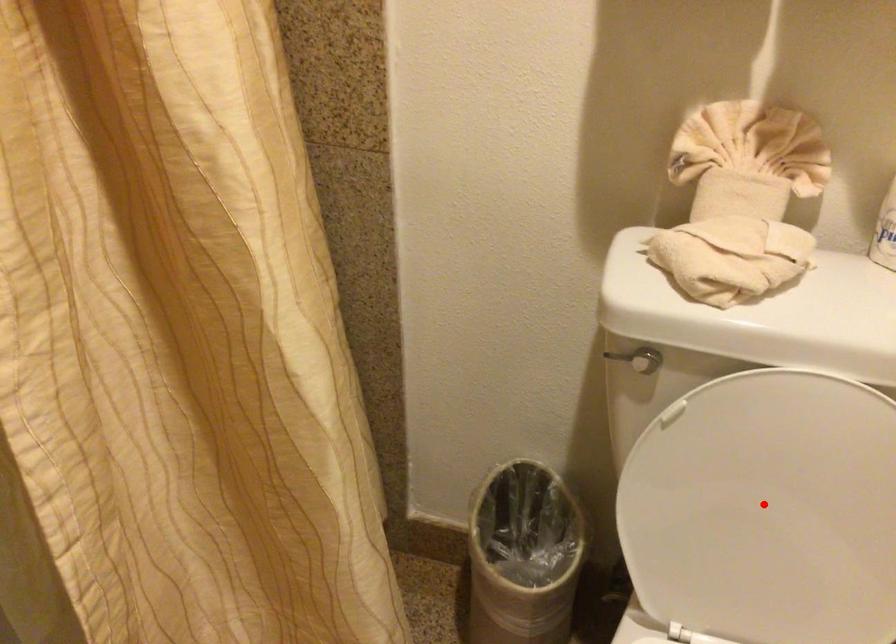
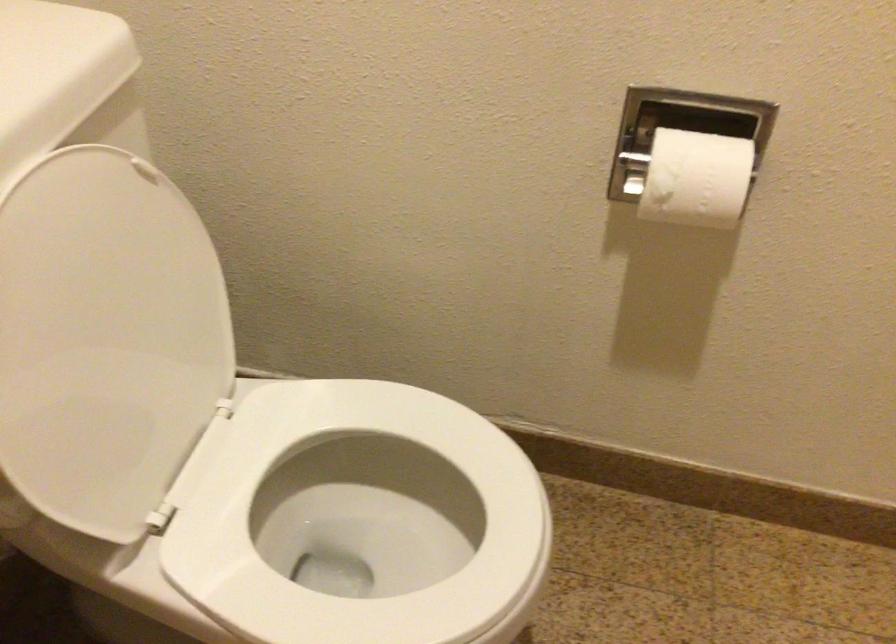
Locate, in the second image, the point that corresponds to the highlighted location in the first image.

(105, 339)